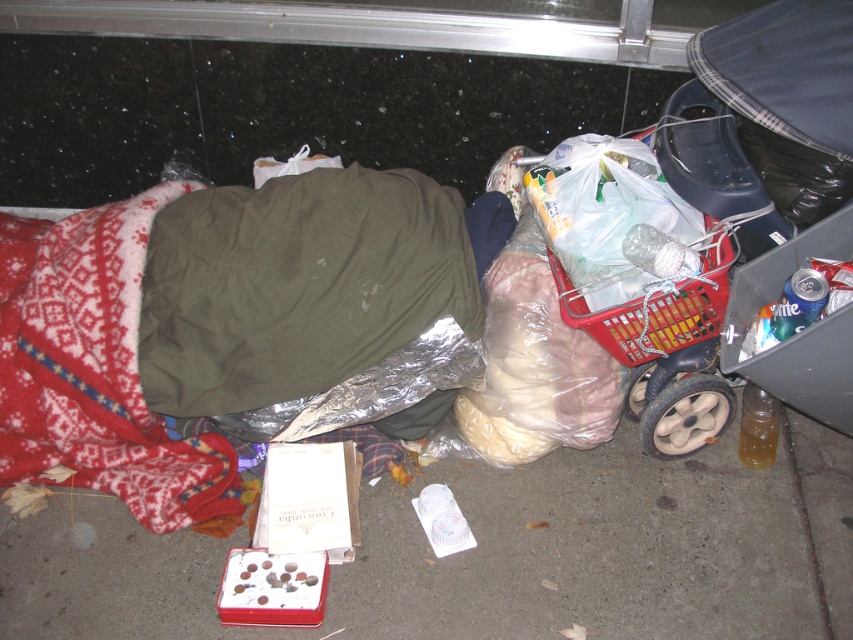
How far apart are olive green fabric sleeping bag at center and red fleece blanket at lower left?

olive green fabric sleeping bag at center and red fleece blanket at lower left are 12.00 inches apart from each other.

Does olive green fabric sleeping bag at center come behind red fleece blanket at lower left?

No, it is in front of red fleece blanket at lower left.

At what (x,y) coordinates should I click in order to perform the action: click on olive green fabric sleeping bag at center. Please return your answer as a coordinate pair (x, y). Looking at the image, I should click on (309, 300).

Based on the photo, is smooth concrete pavement at lower center taller than olive green fabric sleeping bag at center?

Incorrect, smooth concrete pavement at lower center's height is not larger of olive green fabric sleeping bag at center's.

In order to click on smooth concrete pavement at lower center in this screenshot , I will do `click(494, 552)`.

Where is `smooth concrete pavement at lower center`? The image size is (853, 640). smooth concrete pavement at lower center is located at coordinates (494, 552).

Which is more to the right, smooth concrete pavement at lower center or red fleece blanket at lower left?

smooth concrete pavement at lower center

Find the location of a particular element. The image size is (853, 640). smooth concrete pavement at lower center is located at coordinates (494, 552).

This screenshot has height=640, width=853. Identify the location of smooth concrete pavement at lower center. (494, 552).